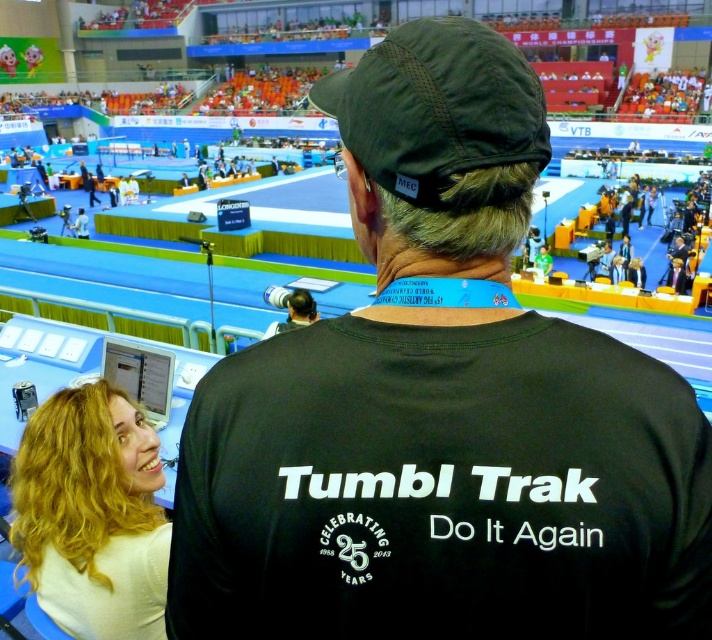
Looking at the scene from the front, which object is positioned to the left of the other between the blonde hair at upper left and the dark green fabric baseball cap at upper center?

The blonde hair at upper left is positioned to the left of the dark green fabric baseball cap at upper center.

You are standing at the entrance of the sports hall and want to reach the point marked at coordinates point [52,426]. If you can walk 1.5 meters per second, how long will it take you to reach that point?

The distance of point [52,426] from viewer is 3.28 meters. At a walking speed of 1.5 meters per second, it would take approximately 2.19 seconds to reach the point.

You are a photographer standing at the back of the arena. You want to take a photo of the dark green fabric baseball cap at upper center without the black fabric shirt at center blocking it. Is this possible?

The black fabric shirt at center is in front of the dark green fabric baseball cap at upper center, so it will block the view. To capture the cap without obstruction, you need to move to a position where the shirt is no longer between you and the cap.